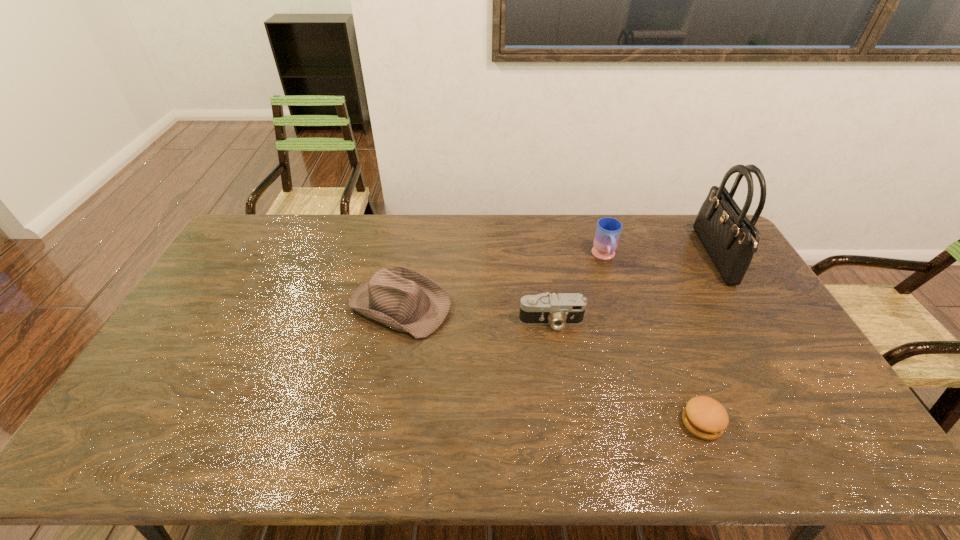
You are a GUI agent. You are given a task and a screenshot of the screen. Output one action in this format:
    pyautogui.click(x=<x>, y=<y>)
    Task: Click on the tallest object
    This screenshot has height=540, width=960.
    Given the screenshot: What is the action you would take?
    pyautogui.click(x=730, y=238)

What are the coordinates of `handbag` in the screenshot? It's located at (730, 238).

Identify the location of the third object from right to left. (608, 230).

The width and height of the screenshot is (960, 540). Find the location of `the leftmost object`. the leftmost object is located at coordinates (405, 300).

Identify the location of camera. The height and width of the screenshot is (540, 960). (557, 310).

You are a GUI agent. You are given a task and a screenshot of the screen. Output one action in this format:
    pyautogui.click(x=<x>, y=<y>)
    Task: Click on the second shortest object
    The width and height of the screenshot is (960, 540).
    Given the screenshot: What is the action you would take?
    pyautogui.click(x=557, y=310)

Where is `the fourth object from left to right`? The height and width of the screenshot is (540, 960). the fourth object from left to right is located at coordinates (704, 417).

Locate an element on the screen. Image resolution: width=960 pixels, height=540 pixels. the shortest object is located at coordinates (704, 417).

The width and height of the screenshot is (960, 540). I want to click on vacant space located 0.090m with an open clasp on the front of the handbag, so click(680, 257).

The height and width of the screenshot is (540, 960). Identify the location of free spot located 0.280m with an open clasp on the front of the handbag. (627, 257).